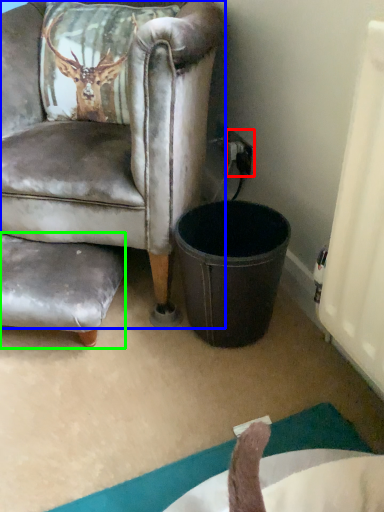
Question: Estimate the real-world distances between objects in this image. Which object is farther from power outlet (highlighted by a red box), chair (highlighted by a blue box) or swivel chair (highlighted by a green box)?

Choices:
 (A) chair
 (B) swivel chair

Answer: (B)